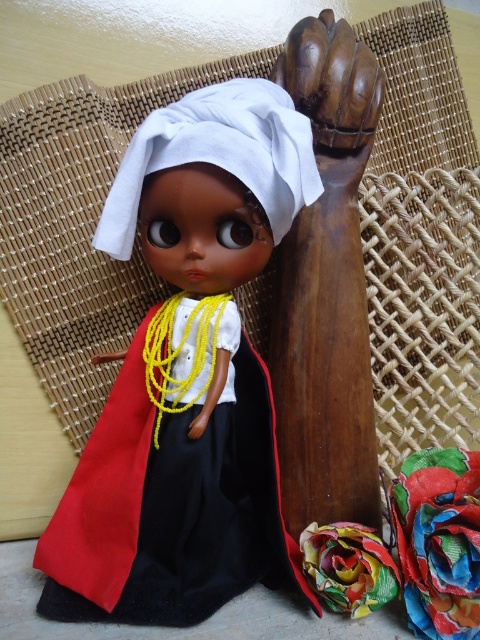
Question: Considering the relative positions of multicolored fabric at lower right and wooden hand at center in the image provided, where is multicolored fabric at lower right located with respect to wooden hand at center?

Choices:
 (A) left
 (B) right

Answer: (B)

Question: Which of these objects is positioned closest to the wooden hand at center?

Choices:
 (A) white cotton cloth at center
 (B) matte black dress at center
 (C) multicolored fabric at lower right

Answer: (B)

Question: Is white cotton cloth at center to the left of wooden hand at center from the viewer's perspective?

Choices:
 (A) yes
 (B) no

Answer: (B)

Question: Considering the real-world distances, which object is farthest from the white cotton cloth at center?

Choices:
 (A) matte black dress at center
 (B) wooden hand at center

Answer: (B)

Question: Does white cotton cloth at center have a smaller size compared to wooden hand at center?

Choices:
 (A) yes
 (B) no

Answer: (B)

Question: Which point appears closest to the camera in this image?

Choices:
 (A) (230, 90)
 (B) (420, 624)

Answer: (B)